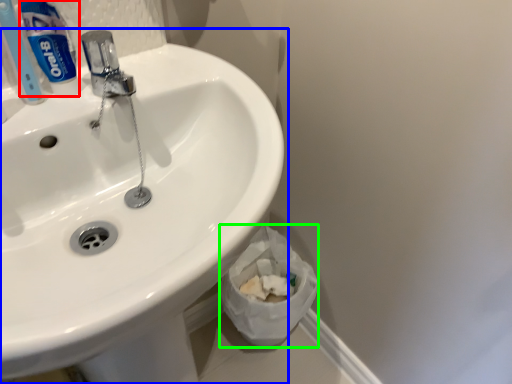
Question: Based on their relative distances, which object is farther from toothpaste (highlighted by a red box)? Choose from sink (highlighted by a blue box) and toilet paper (highlighted by a green box).

Choices:
 (A) sink
 (B) toilet paper

Answer: (B)